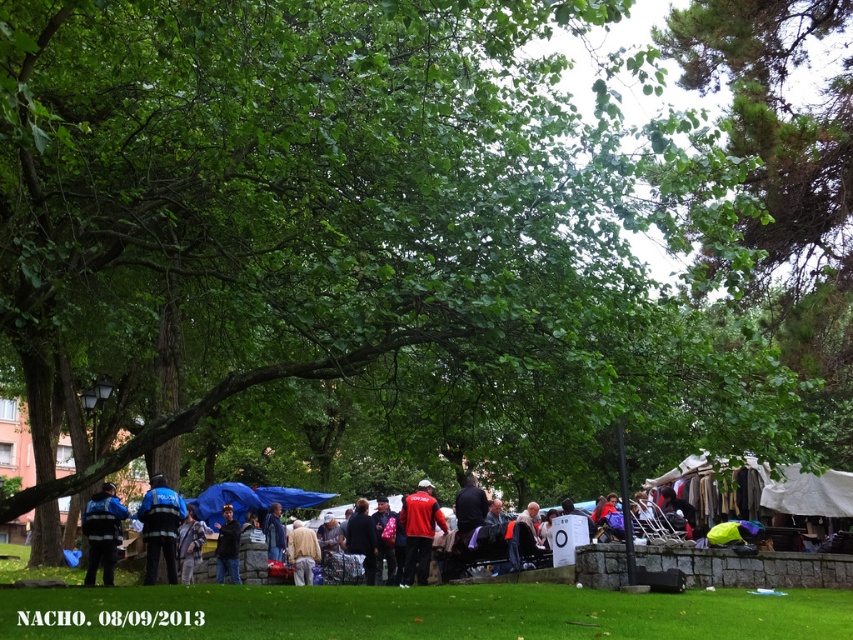
You are a photographer trying to capture a detailed shot of the light beige fabric at center without the dark blue fabric at center blocking it. What adjustment should you make to your camera angle?

The dark blue fabric at center is located above the light beige fabric at center, so you should lower your camera angle to avoid the dark blue fabric at center blocking the view of the light beige fabric at center.

You are a photographer trying to capture a clear shot of the reflective blue uniform at center and the light beige fabric at center. Which object should you focus on first if you want to ensure both are in focus without adjusting the camera settings?

The reflective blue uniform at center is located above the light beige fabric at center, so you should focus on the reflective blue uniform at center first since it is closer to the camera.

You are planning to set up a picnic in the park and have two picnic blankets with you. One is a dark blue fabric at center and the other is a light beige fabric at center. Which one would you choose if you want to cover a larger area?

The light beige fabric at center occupies more space than the dark blue fabric at center, so you should choose the light beige fabric at center to cover a larger area.